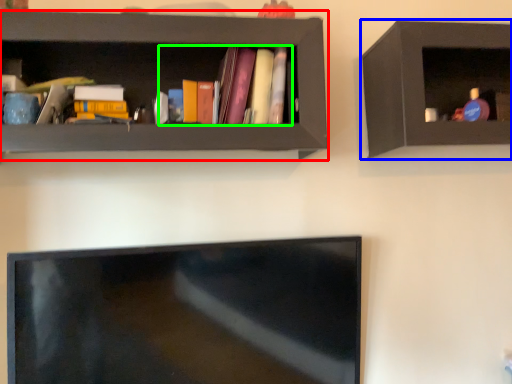
Question: Estimate the real-world distances between objects in this image. Which object is closer to shelf (highlighted by a red box), shelf (highlighted by a blue box) or book (highlighted by a green box)?

Choices:
 (A) shelf
 (B) book

Answer: (B)